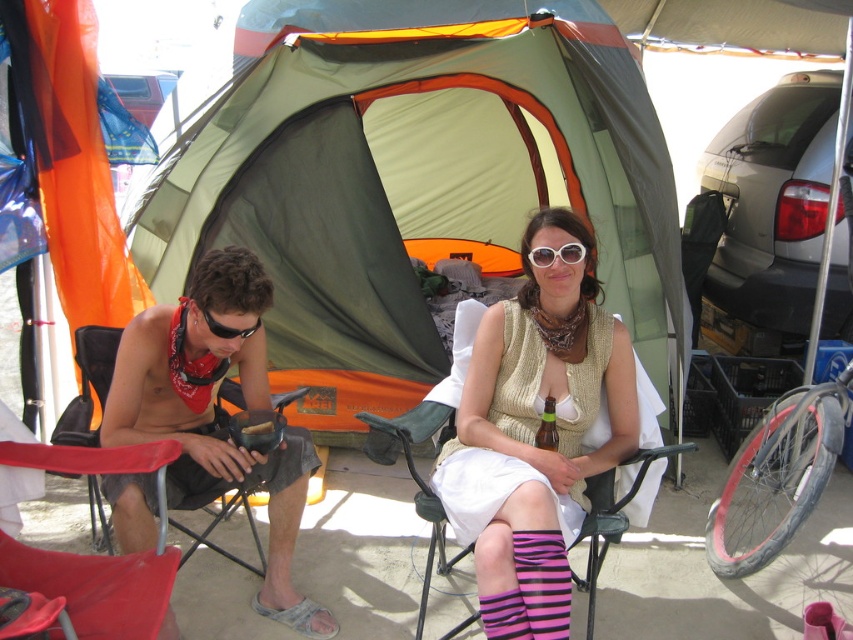
Is point (206, 545) behind point (222, 371)?

Yes, point (206, 545) is farther from viewer.

Which of these two, red plastic chair at left or matte red bikini top at left, stands taller?

With more height is matte red bikini top at left.

Between point (242, 499) and point (219, 371), which one is positioned in front?

Point (219, 371) is in front.

Find the location of a particular element. Image resolution: width=853 pixels, height=640 pixels. red plastic chair at left is located at coordinates (96, 356).

Is white knitted vest at center to the left of matte red bikini top at left from the viewer's perspective?

In fact, white knitted vest at center is to the right of matte red bikini top at left.

Is point (509, 477) less distant than point (204, 372)?

Yes.

Find the location of `white knitted vest at center`. white knitted vest at center is located at coordinates (537, 429).

Between white knitted vest at center and red plastic chair at left, which one appears on the left side from the viewer's perspective?

red plastic chair at left is more to the left.

Who is taller, white knitted vest at center or red plastic chair at left?

Standing taller between the two is white knitted vest at center.

This screenshot has width=853, height=640. What are the coordinates of `white knitted vest at center` in the screenshot? It's located at (537, 429).

Locate an element on the screen. Image resolution: width=853 pixels, height=640 pixels. white knitted vest at center is located at coordinates (537, 429).